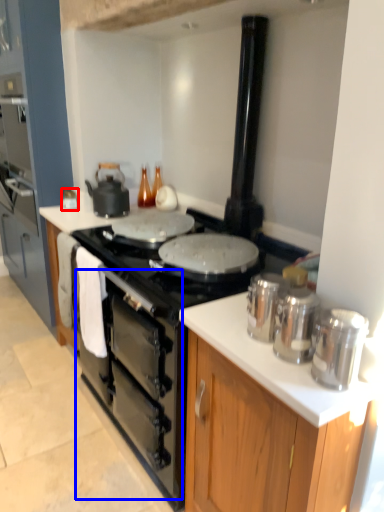
Question: Which point is closer to the camera, kitchen appliance (highlighted by a red box) or oven (highlighted by a blue box)?

Choices:
 (A) kitchen appliance
 (B) oven

Answer: (B)